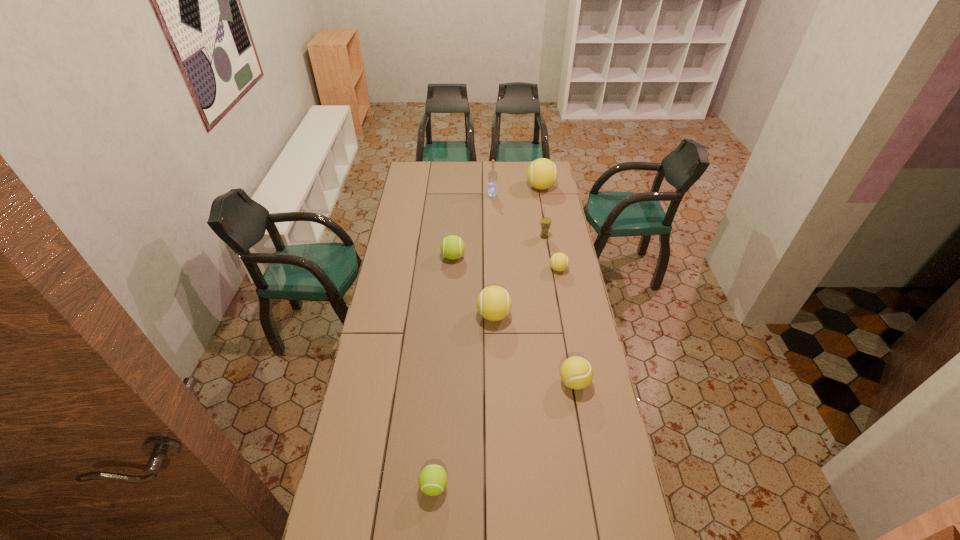
Find the location of a particular element. This screenshot has width=960, height=540. tennis ball that is the third closest one to the third farthest object is located at coordinates (452, 247).

You are a GUI agent. You are given a task and a screenshot of the screen. Output one action in this format:
    pyautogui.click(x=<x>, y=<y>)
    Task: Click on the tennis ball that can be found as the closest to the nearer green tennis ball
    Image resolution: width=960 pixels, height=540 pixels.
    Given the screenshot: What is the action you would take?
    pyautogui.click(x=576, y=372)

The width and height of the screenshot is (960, 540). What are the coordinates of `the third closest yellow tennis ball relative to the third nearest yellow tennis ball` in the screenshot? It's located at click(542, 173).

Where is `the closest yellow tennis ball relative to the nearest object`? Image resolution: width=960 pixels, height=540 pixels. the closest yellow tennis ball relative to the nearest object is located at coordinates (576, 372).

Find the location of a particular element. This screenshot has height=540, width=960. vacant space that satisfies the following two spatial constraints: 1. on the back side of the nearer green tennis ball; 2. on the left side of the straw for drinking is located at coordinates (452, 237).

Where is `vacant space that satisfies the following two spatial constraints: 1. on the back side of the second tallest tennis ball; 2. on the left side of the yellow straw for drinking`? The height and width of the screenshot is (540, 960). vacant space that satisfies the following two spatial constraints: 1. on the back side of the second tallest tennis ball; 2. on the left side of the yellow straw for drinking is located at coordinates 492,237.